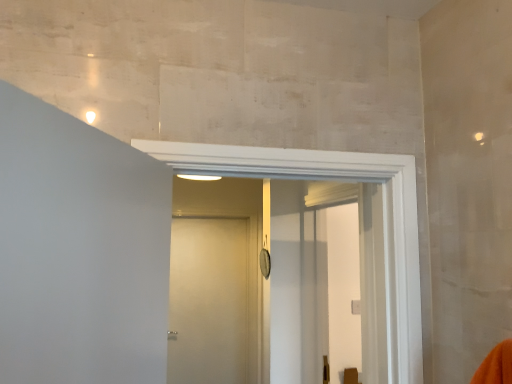
Find the location of a particular element. Image resolution: width=512 pixels, height=384 pixels. white matte door at center is located at coordinates (208, 301).

This screenshot has width=512, height=384. What do you see at coordinates (208, 301) in the screenshot? I see `white matte door at center` at bounding box center [208, 301].

Locate an element on the screen. Image resolution: width=512 pixels, height=384 pixels. white matte door at center is located at coordinates (208, 301).